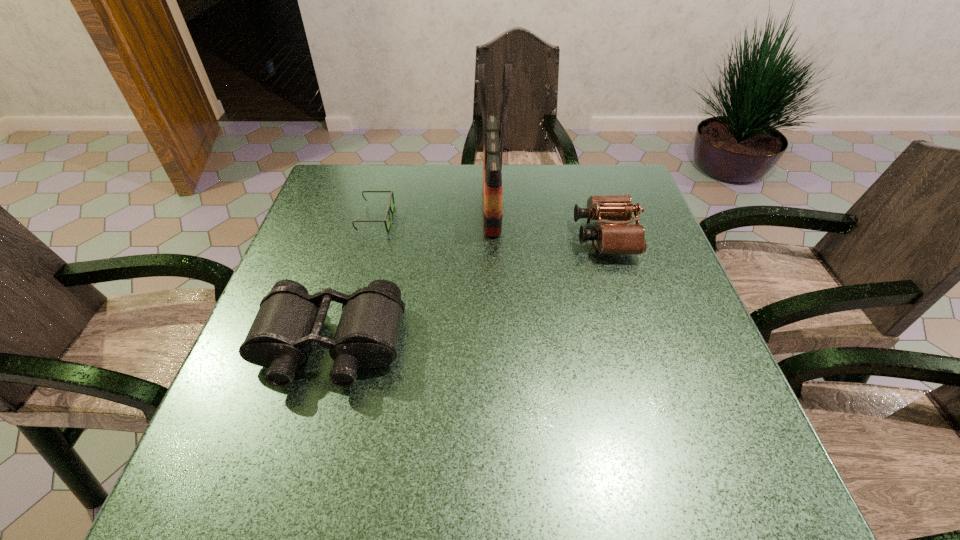
You are a GUI agent. You are given a task and a screenshot of the screen. Output one action in this format:
    pyautogui.click(x=<x>, y=<y>)
    Task: Click on the free region located 0.310m through the eyepieces of the rightmost object
    This screenshot has height=540, width=960.
    Given the screenshot: What is the action you would take?
    pyautogui.click(x=455, y=236)

Find the location of a particular element. The image size is (960, 540). vacant region located 0.150m through the eyepieces of the rightmost object is located at coordinates pyautogui.click(x=517, y=236).

The height and width of the screenshot is (540, 960). I want to click on vacant area situated through the eyepieces of the rightmost object, so click(431, 236).

You are a GUI agent. You are given a task and a screenshot of the screen. Output one action in this format:
    pyautogui.click(x=<x>, y=<y>)
    Task: Click on the vacant area located through the eyepieces of the nearer binoculars
    The image size is (960, 540).
    Given the screenshot: What is the action you would take?
    pyautogui.click(x=294, y=470)

Image resolution: width=960 pixels, height=540 pixels. Identify the location of free space located on the lens of the shortest object. (429, 219).

Locate an element on the screen. This screenshot has height=540, width=960. shopping bag located in the far edge section of the desktop is located at coordinates (492, 161).

Where is `spectacles at the far edge`? The width and height of the screenshot is (960, 540). spectacles at the far edge is located at coordinates click(389, 209).

The width and height of the screenshot is (960, 540). What are the coordinates of `binoculars at the left edge` in the screenshot? It's located at (289, 320).

You are a GUI agent. You are given a task and a screenshot of the screen. Output one action in this format:
    pyautogui.click(x=<x>, y=<y>)
    Task: Click on the spectacles present at the left edge
    The height and width of the screenshot is (540, 960).
    Given the screenshot: What is the action you would take?
    pyautogui.click(x=389, y=209)

Identify the location of object positioned at the right edge. This screenshot has height=540, width=960. click(618, 237).